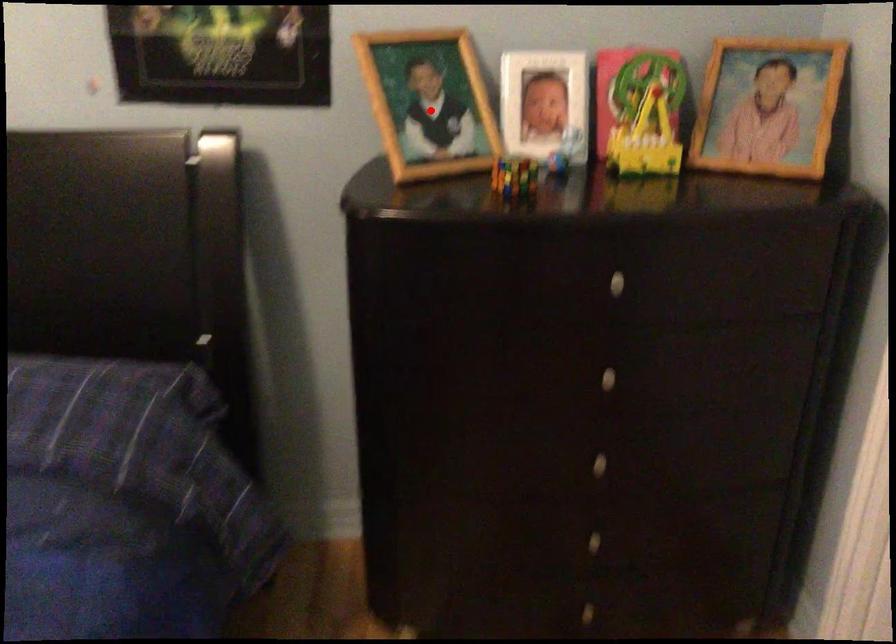
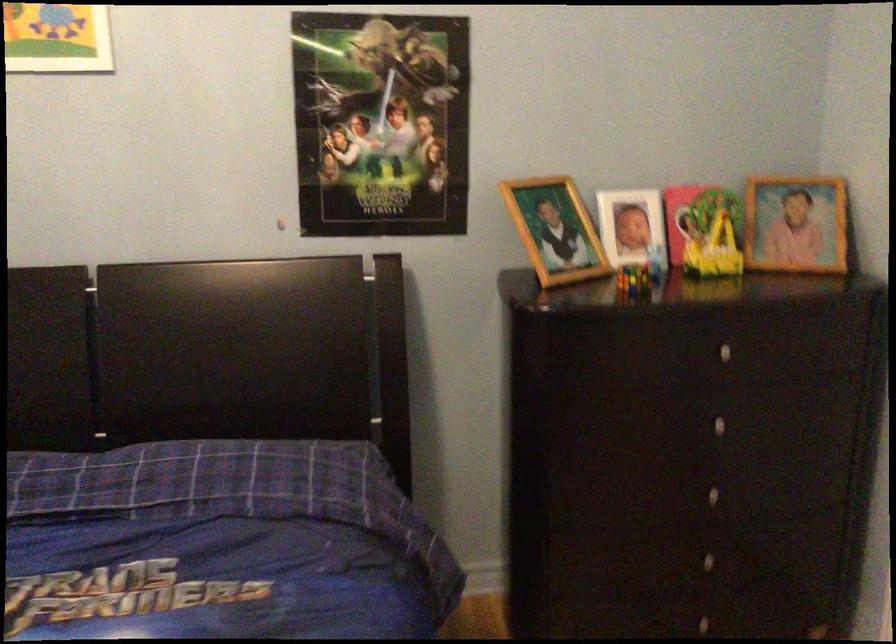
Question: I am providing you with two images of the same scene from different viewpoints. A red point is shown in image1. For the corresponding object point in image2, is it positioned nearer or farther from the camera?

Choices:
 (A) Nearer
 (B) Farther

Answer: (B)